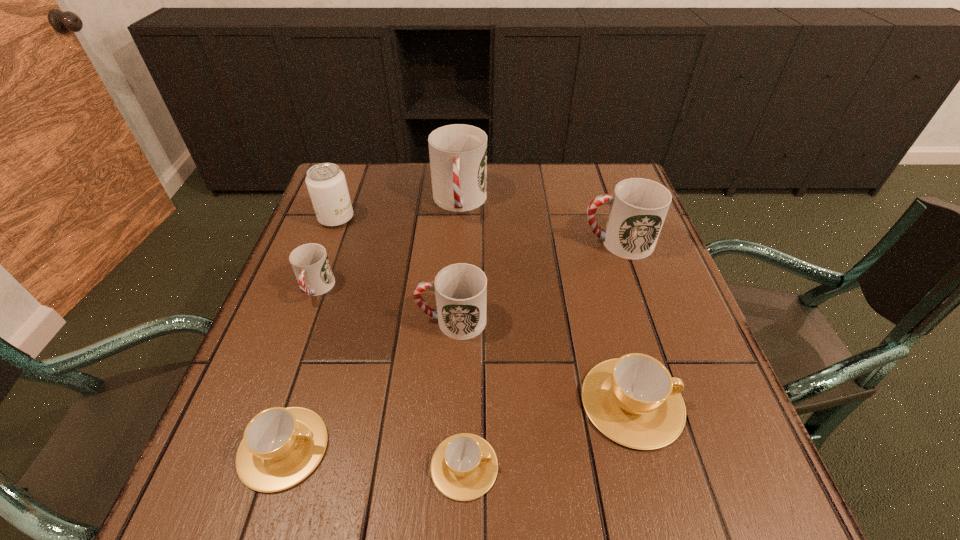
Where is `unoccupied position between the fifth shortest object and the soda can`? Image resolution: width=960 pixels, height=540 pixels. unoccupied position between the fifth shortest object and the soda can is located at coordinates (395, 269).

The image size is (960, 540). Find the location of `blank region between the shortest cup and the second shortest object`. blank region between the shortest cup and the second shortest object is located at coordinates (373, 457).

The image size is (960, 540). I want to click on vacant area that lies between the sixth shortest cup and the soda can, so click(x=477, y=231).

This screenshot has width=960, height=540. I want to click on free point between the soda can and the tallest object, so click(398, 211).

This screenshot has width=960, height=540. I want to click on blank region between the sixth shortest cup and the tallest object, so click(539, 222).

Where is `blank region between the second smallest brown cup and the soda can`? The height and width of the screenshot is (540, 960). blank region between the second smallest brown cup and the soda can is located at coordinates (310, 333).

Locate which object is the fifth closest to the biggest brown cup. Please provide its 2D coordinates. Your answer should be formatted as a tuple, i.e. [(x, y)], where the tuple contains the x and y coordinates of a point satisfying the conditions above.

[(458, 153)]

Identify which object is the third closest to the soda can. Please provide its 2D coordinates. Your answer should be formatted as a tuple, i.e. [(x, y)], where the tuple contains the x and y coordinates of a point satisfying the conditions above.

[(460, 289)]

I want to click on the closest cup relative to the soda can, so click(310, 263).

Where is `cup that is the fourth closest one to the shortest cup`? The height and width of the screenshot is (540, 960). cup that is the fourth closest one to the shortest cup is located at coordinates (310, 263).